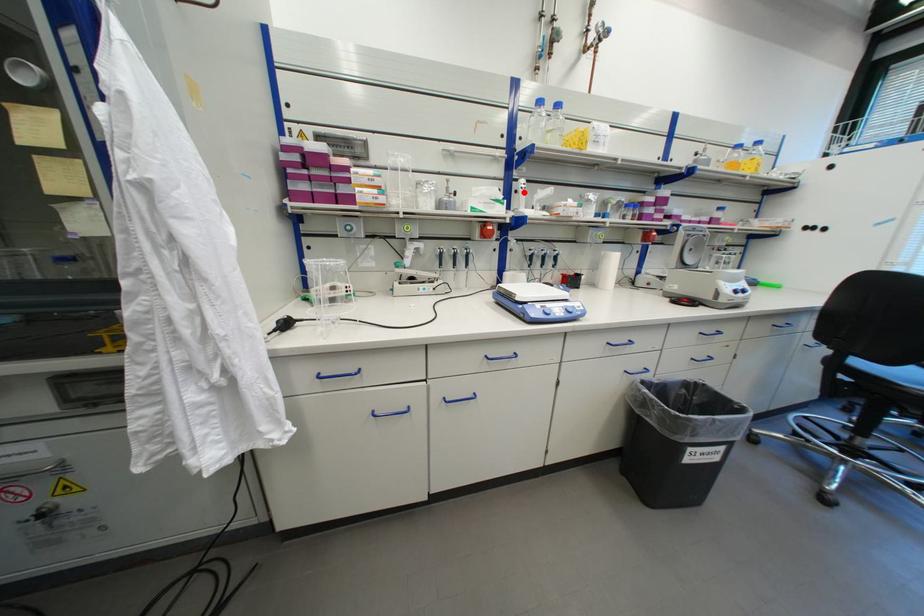
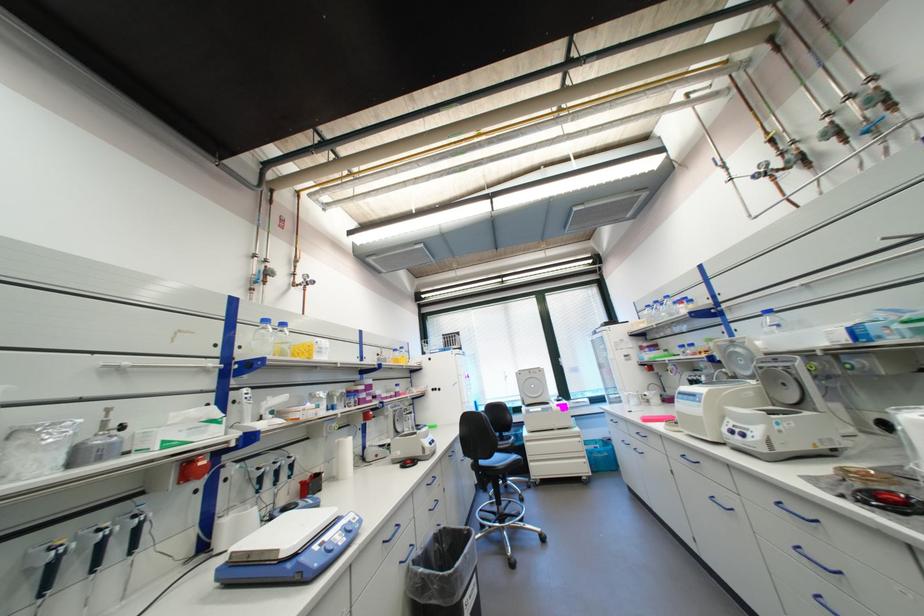
The point at the highlighted location is marked in the first image. Where is the corresponding point in the second image?

(242, 403)